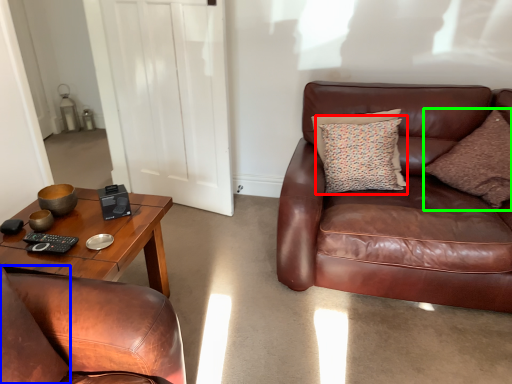
Question: Which is nearer to the pillow (highlighted by a red box)? pillow (highlighted by a blue box) or pillow (highlighted by a green box).

Choices:
 (A) pillow
 (B) pillow

Answer: (B)